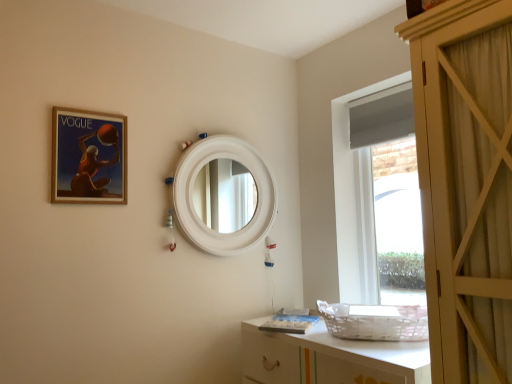
Locate an element on the screen. empty space that is ontop of white matte mirror at center (from a real-world perspective) is located at coordinates (218, 123).